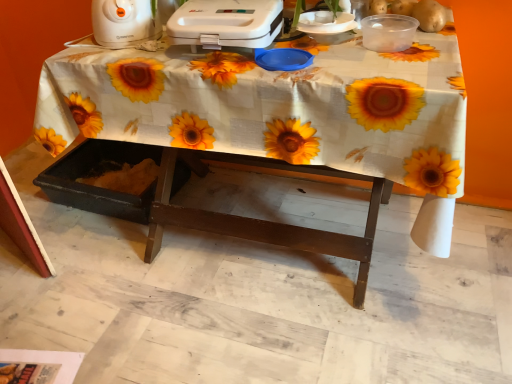
Image resolution: width=512 pixels, height=384 pixels. Find the location of `vacant space situated on the left part of white plastic toaster at upper center, which is the 2th appliance from left to right`. vacant space situated on the left part of white plastic toaster at upper center, which is the 2th appliance from left to right is located at coordinates (139, 56).